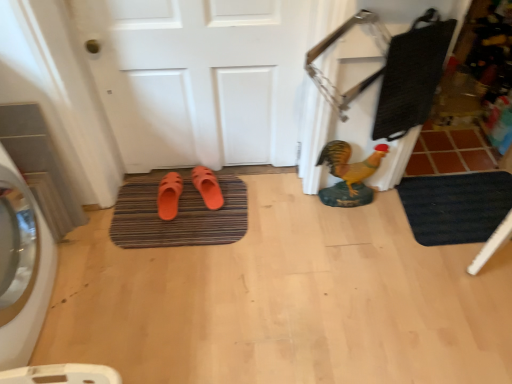
Locate an element on the screen. This screenshot has height=384, width=512. empty space that is in between yellow matte chicken at center-right and black rubber bath mat at lower right, which is counted as the second bath mat, starting from the left is located at coordinates (377, 218).